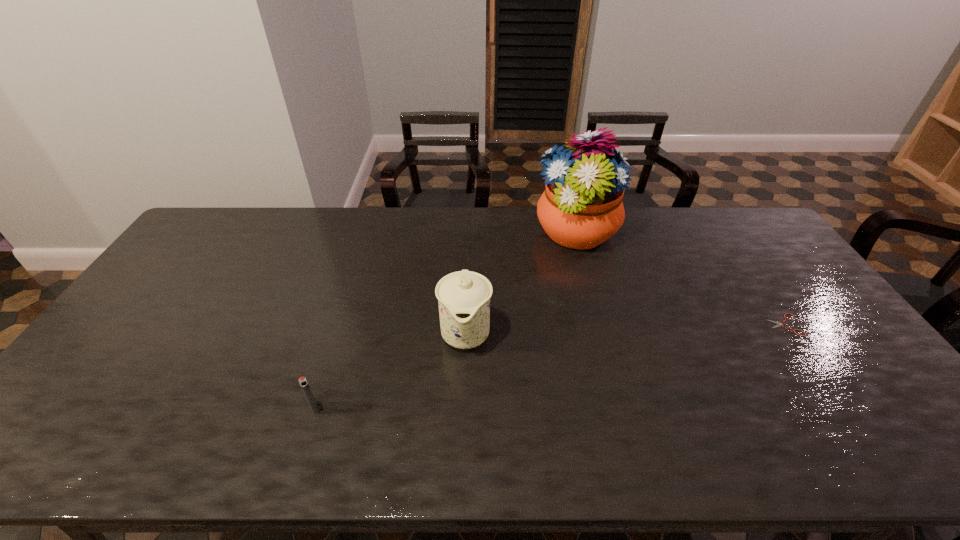
This screenshot has height=540, width=960. In order to click on flower arrangement in this screenshot , I will do [581, 207].

Where is `the tallest object`? The image size is (960, 540). the tallest object is located at coordinates (581, 207).

The width and height of the screenshot is (960, 540). I want to click on the third object from right to left, so click(464, 296).

Where is `the second tallest object`? Image resolution: width=960 pixels, height=540 pixels. the second tallest object is located at coordinates (464, 296).

At what (x,y) coordinates should I click in order to perform the action: click on the third tallest object. Please return your answer as a coordinate pair (x, y). The image size is (960, 540). Looking at the image, I should click on (303, 383).

This screenshot has width=960, height=540. What are the coordinates of `the leftmost object` in the screenshot? It's located at (303, 383).

At what (x,y) coordinates should I click in order to perform the action: click on the shortest object. Please return your answer as a coordinate pair (x, y). This screenshot has height=540, width=960. Looking at the image, I should click on (780, 322).

At what (x,y) coordinates should I click in order to perform the action: click on shears. Please return your answer as a coordinate pair (x, y). The image size is (960, 540). Looking at the image, I should click on (780, 322).

Identify the location of vacant region located 0.150m on the right of the second object from right to left. (661, 234).

In order to click on vacant region located on the spout of the third shortest object in this screenshot , I will do `click(463, 407)`.